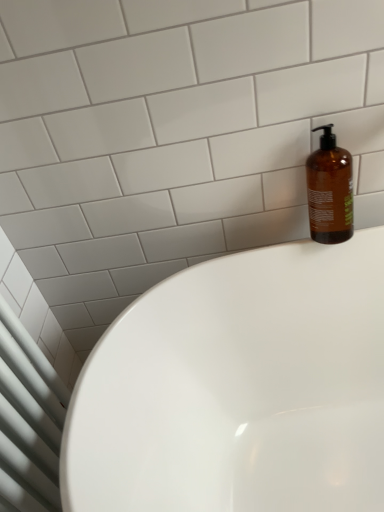
Find the location of a particular element. brown glass bottle at upper right is located at coordinates (330, 190).

Describe the element at coordinates (330, 190) in the screenshot. I see `brown glass bottle at upper right` at that location.

This screenshot has width=384, height=512. In order to click on brown glass bottle at upper right in this screenshot , I will do tap(330, 190).